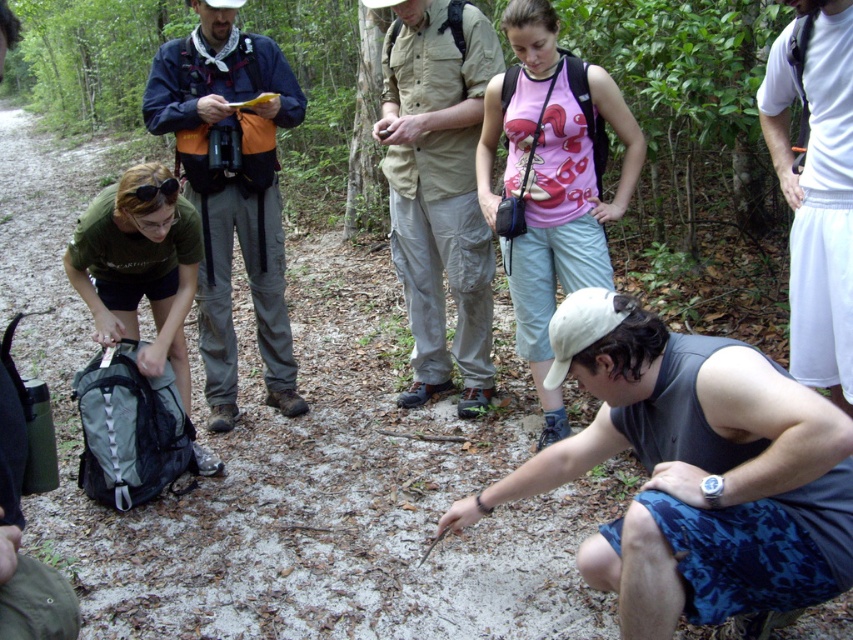
Can you confirm if khaki cotton shirt at center is positioned to the left of dark blue jacket at center?

Incorrect, khaki cotton shirt at center is not on the left side of dark blue jacket at center.

Which is behind, point (434, 157) or point (155, 88)?

Positioned behind is point (155, 88).

Identify the location of khaki cotton shirt at center. This screenshot has width=853, height=640. (439, 188).

Is gray fabric shorts at lower right closer to camera compared to white cotton shirt at upper right?

Yes, it is.

Which is below, gray fabric shorts at lower right or white cotton shirt at upper right?

Positioned lower is gray fabric shorts at lower right.

Who is more forward, (x=718, y=600) or (x=821, y=291)?

Point (x=718, y=600) is in front.

This screenshot has height=640, width=853. What are the coordinates of `gray fabric shorts at lower right` in the screenshot? It's located at (694, 472).

Can you confirm if gray fabric shorts at lower right is shorter than khaki cotton shirt at center?

Correct, gray fabric shorts at lower right is not as tall as khaki cotton shirt at center.

What do you see at coordinates (694, 472) in the screenshot? I see `gray fabric shorts at lower right` at bounding box center [694, 472].

Find the location of a particular element. The width and height of the screenshot is (853, 640). gray fabric shorts at lower right is located at coordinates (694, 472).